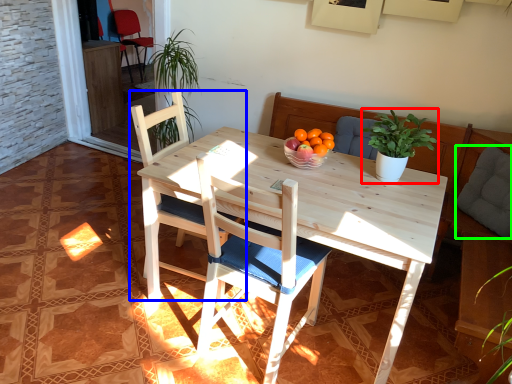
Question: Which object is the closest to the houseplant (highlighted by a red box)? Choose among these: chair (highlighted by a blue box) or pillow (highlighted by a green box).

Choices:
 (A) chair
 (B) pillow

Answer: (B)